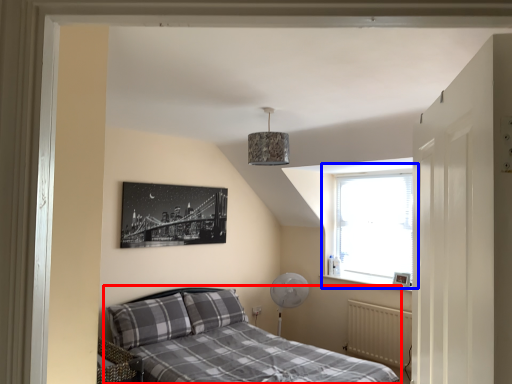
Question: Which point is further to the camera, bed (highlighted by a red box) or window (highlighted by a blue box)?

Choices:
 (A) bed
 (B) window

Answer: (B)